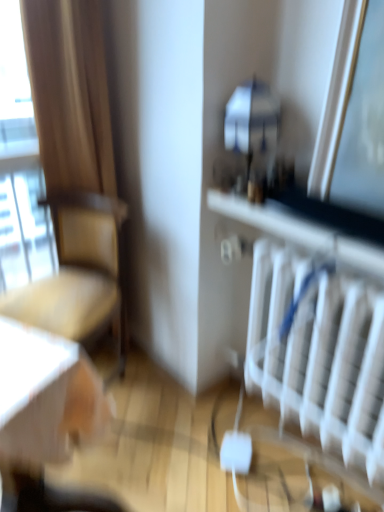
Question: Considering the relative sizes of beige fabric chair at left and white plastic radiator at lower right in the image provided, is beige fabric chair at left bigger than white plastic radiator at lower right?

Choices:
 (A) yes
 (B) no

Answer: (A)

Question: Considering the relative sizes of beige fabric chair at left and white plastic radiator at lower right in the image provided, is beige fabric chair at left shorter than white plastic radiator at lower right?

Choices:
 (A) yes
 (B) no

Answer: (B)

Question: Is beige fabric chair at left closer to camera compared to white plastic radiator at lower right?

Choices:
 (A) yes
 (B) no

Answer: (B)

Question: Is beige fabric chair at left located outside white plastic radiator at lower right?

Choices:
 (A) no
 (B) yes

Answer: (B)

Question: Is white plastic radiator at lower right at the back of beige fabric chair at left?

Choices:
 (A) no
 (B) yes

Answer: (A)

Question: Looking at the image, does white plastic radiator at lower right seem bigger or smaller compared to beige fabric chair at left?

Choices:
 (A) big
 (B) small

Answer: (B)

Question: In terms of width, does white plastic radiator at lower right look wider or thinner when compared to beige fabric chair at left?

Choices:
 (A) thin
 (B) wide

Answer: (A)

Question: Considering their positions, is white plastic radiator at lower right located in front of or behind beige fabric chair at left?

Choices:
 (A) behind
 (B) front

Answer: (B)

Question: Is white plastic radiator at lower right spatially inside beige fabric chair at left, or outside of it?

Choices:
 (A) inside
 (B) outside

Answer: (B)

Question: From the image's perspective, relative to white plastic radiator at lower right, is transparent glass window at left above or below?

Choices:
 (A) below
 (B) above

Answer: (B)

Question: Looking at their shapes, would you say transparent glass window at left is wider or thinner than white plastic radiator at lower right?

Choices:
 (A) wide
 (B) thin

Answer: (B)

Question: Is transparent glass window at left taller or shorter than white plastic radiator at lower right?

Choices:
 (A) short
 (B) tall

Answer: (B)

Question: Considering the relative positions of transparent glass window at left and white plastic radiator at lower right in the image provided, is transparent glass window at left to the left or to the right of white plastic radiator at lower right?

Choices:
 (A) left
 (B) right

Answer: (A)

Question: Relative to transparent glass window at left, is white plastic radiator at lower right in front or behind?

Choices:
 (A) front
 (B) behind

Answer: (A)

Question: From the image's perspective, relative to transparent glass window at left, is white plastic radiator at lower right above or below?

Choices:
 (A) below
 (B) above

Answer: (A)